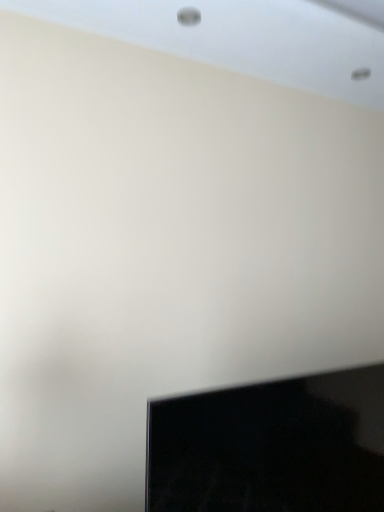
Question: Should I look upward or downward to see black glossy tv at lower right?

Choices:
 (A) up
 (B) down

Answer: (B)